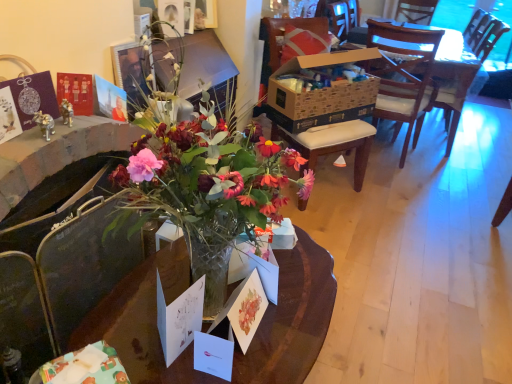
Locate an element on the screen. The image size is (512, 384). vacant area to the right of wooden armchair at center is located at coordinates (482, 146).